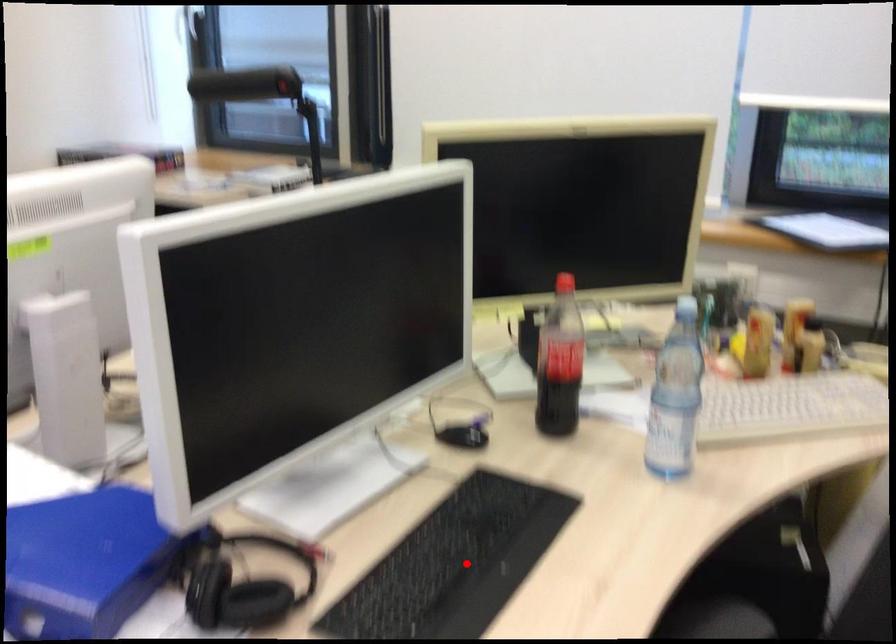
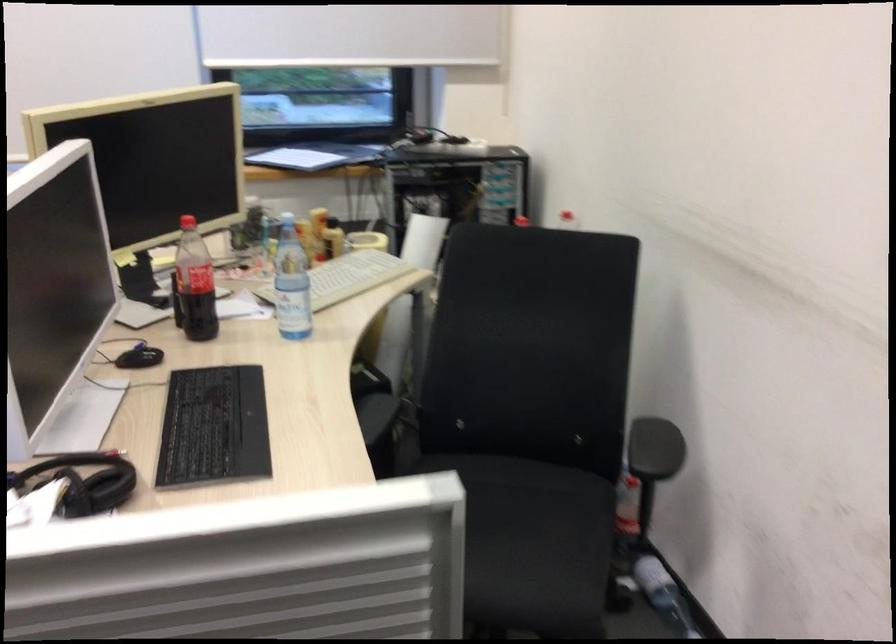
Question: I am providing you with two images of the same scene from different viewpoints. A red point is shown in image1. For the corresponding object point in image2, is it positioned nearer or farther from the camera?

Choices:
 (A) Nearer
 (B) Farther

Answer: (B)